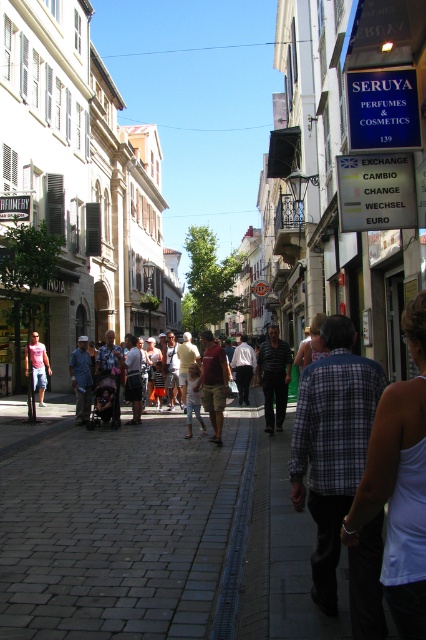
In the scene shown: You are a tourist holding a matte pink shirt at left and want to cross the gray cobblestone pavement at center to reach the perfume shop on the right. Can you walk across the pavement without the shirt touching the ground?

The gray cobblestone pavement at center might be wider than matte pink shirt at left, so it is possible to walk across without the shirt touching the ground as long as you hold it properly.